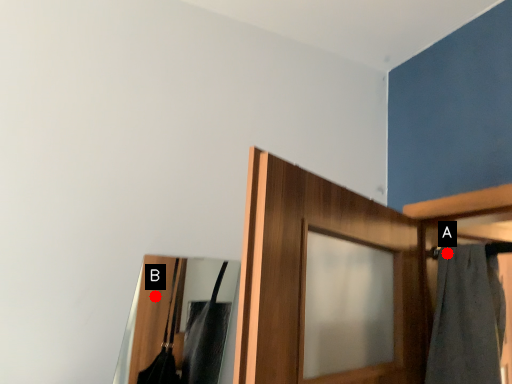
Question: Two points are circled on the image, labeled by A and B beside each circle. Which point is further to the camera?

Choices:
 (A) A is further
 (B) B is further

Answer: (B)